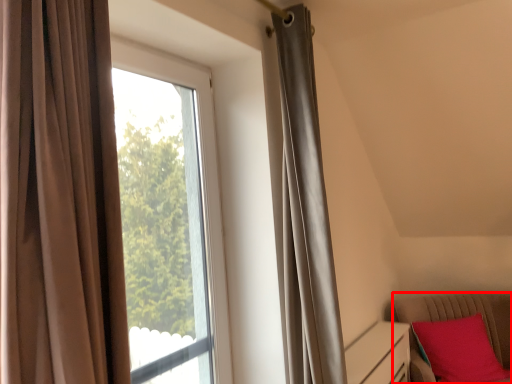
Question: Observing the image, what is the correct spatial positioning of furniture (annotated by the red box) in reference to window?

Choices:
 (A) left
 (B) right

Answer: (B)